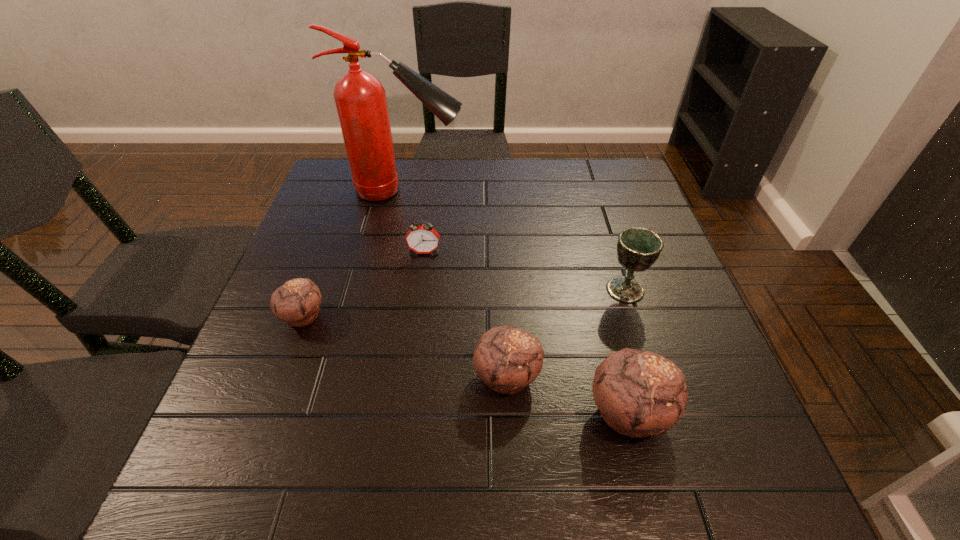
This screenshot has height=540, width=960. Identify the location of free point that satisfies the following two spatial constraints: 1. on the back side of the tallest muffin; 2. on the right side of the chalice. (597, 289).

At what (x,y) coordinates should I click in order to perform the action: click on free spot that satisfies the following two spatial constraints: 1. on the clock face of the second tallest muffin; 2. on the left side of the alarm clock. Please return your answer as a coordinate pair (x, y). The image size is (960, 540). Looking at the image, I should click on (408, 376).

Locate an element on the screen. This screenshot has height=540, width=960. free space in the image that satisfies the following two spatial constraints: 1. at the nozzle end of the chalice; 2. on the left side of the farthest object is located at coordinates (385, 289).

You are a GUI agent. You are given a task and a screenshot of the screen. Output one action in this format:
    pyautogui.click(x=<x>, y=<y>)
    Task: Click on the vacant area that satisfies the following two spatial constraints: 1. on the clock face of the alarm clock; 2. on the left side of the chalice
    
    Given the screenshot: What is the action you would take?
    pyautogui.click(x=420, y=289)

Where is `free space that satisfies the following two spatial constraints: 1. on the back side of the rightmost muffin; 2. on the right side of the chalice`? free space that satisfies the following two spatial constraints: 1. on the back side of the rightmost muffin; 2. on the right side of the chalice is located at coordinates (597, 289).

Find the location of a particular element. vacant space that satisfies the following two spatial constraints: 1. on the back side of the chalice; 2. on the left side of the rightmost muffin is located at coordinates (597, 289).